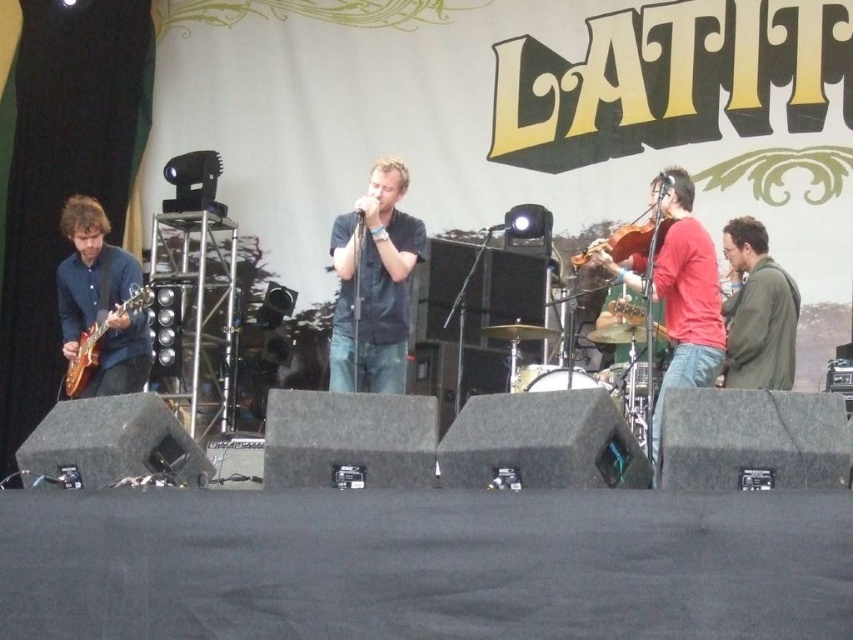
Does green matte jacket at right come behind electric wood guitar at left?

No.

Between green matte jacket at right and electric wood guitar at left, which one is positioned higher?

green matte jacket at right is higher up.

Locate an element on the screen. green matte jacket at right is located at coordinates (757, 310).

Locate an element on the screen. The image size is (853, 640). green matte jacket at right is located at coordinates (757, 310).

Who is positioned more to the left, dark blue shirt at center or green matte jacket at right?

dark blue shirt at center is more to the left.

Is the position of dark blue shirt at center less distant than that of green matte jacket at right?

No, it is not.

Between point (368, 340) and point (770, 259), which one is positioned in front?

Point (368, 340)

At what (x,y) coordinates should I click in order to perform the action: click on dark blue shirt at center. Please return your answer as a coordinate pair (x, y). This screenshot has height=640, width=853. Looking at the image, I should click on (374, 284).

Who is positioned more to the left, dark blue shirt at center or electric wood guitar at left?

From the viewer's perspective, electric wood guitar at left appears more on the left side.

Between dark blue shirt at center and electric wood guitar at left, which one is positioned higher?

dark blue shirt at center

Is point (338, 336) farther from viewer compared to point (68, 378)?

No, (338, 336) is closer to viewer.

You are a GUI agent. You are given a task and a screenshot of the screen. Output one action in this format:
    pyautogui.click(x=<x>, y=<y>)
    Task: Click on the dark blue shirt at center
    
    Given the screenshot: What is the action you would take?
    pyautogui.click(x=374, y=284)